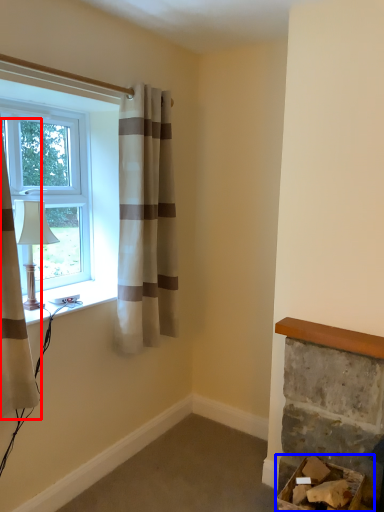
Question: Which object is closer to the camera taking this photo, curtain (highlighted by a red box) or furniture (highlighted by a blue box)?

Choices:
 (A) curtain
 (B) furniture

Answer: (A)